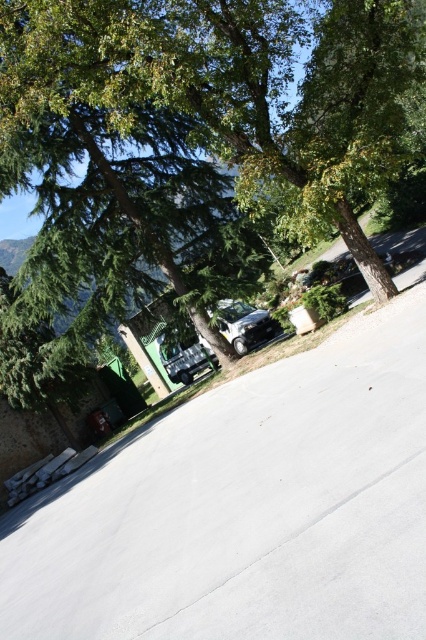
Question: Is green leafy tree at upper left wider than satin silver car at center?

Choices:
 (A) no
 (B) yes

Answer: (B)

Question: Can you confirm if green leafy tree at upper left is smaller than satin silver car at center?

Choices:
 (A) yes
 (B) no

Answer: (B)

Question: Is green leafy tree at upper left closer to the viewer compared to satin silver car at center?

Choices:
 (A) yes
 (B) no

Answer: (A)